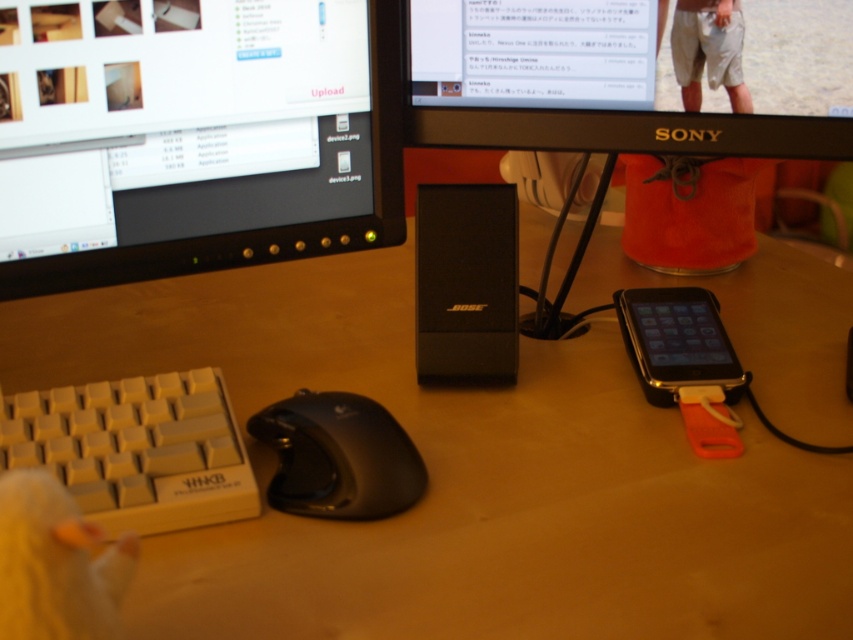
Is point (738, 29) closer to viewer compared to point (665, 316)?

Yes, point (738, 29) is in front of point (665, 316).

Based on the photo, which of these two, black plastic speaker at center or black glossy smartphone at lower right, stands shorter?

black glossy smartphone at lower right is shorter.

Between point (833, 67) and point (662, 348), which one is positioned behind?

The point (662, 348) is more distant.

Where is `black plastic speaker at center`? black plastic speaker at center is located at coordinates (630, 76).

Is black glossy monitor at upper left to the right of white plastic keyboard at lower left from the viewer's perspective?

Indeed, black glossy monitor at upper left is positioned on the right side of white plastic keyboard at lower left.

The width and height of the screenshot is (853, 640). What do you see at coordinates (193, 134) in the screenshot?
I see `black glossy monitor at upper left` at bounding box center [193, 134].

Between point (107, 145) and point (186, 454), which one is positioned behind?

Positioned behind is point (107, 145).

Where is `black glossy monitor at upper left`? black glossy monitor at upper left is located at coordinates (193, 134).

Between wooden at center and black glossy smartphone at lower right, which one is positioned higher?

Positioned higher is black glossy smartphone at lower right.

Can you confirm if wooden at center is positioned below black glossy smartphone at lower right?

Yes, wooden at center is below black glossy smartphone at lower right.

The width and height of the screenshot is (853, 640). Identify the location of wooden at center. 456,477.